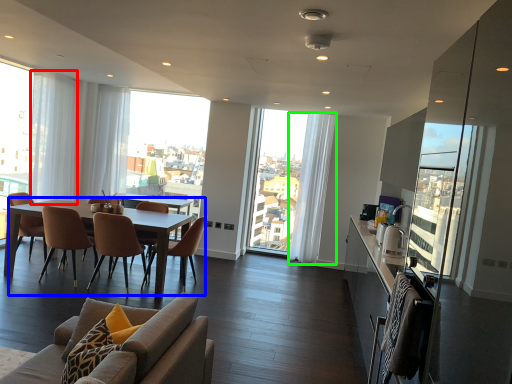
Question: Based on their relative distances, which object is nearer to curtain (highlighted by a red box)? Choose from coffee table (highlighted by a blue box) and curtain (highlighted by a green box).

Choices:
 (A) coffee table
 (B) curtain

Answer: (A)